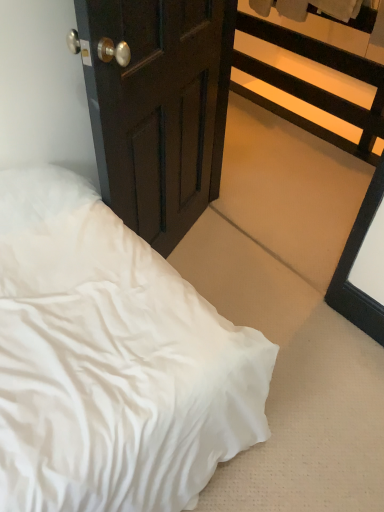
This screenshot has height=512, width=384. In order to click on vacant space in front of black wood balustrade at upper right in this screenshot , I will do `click(294, 166)`.